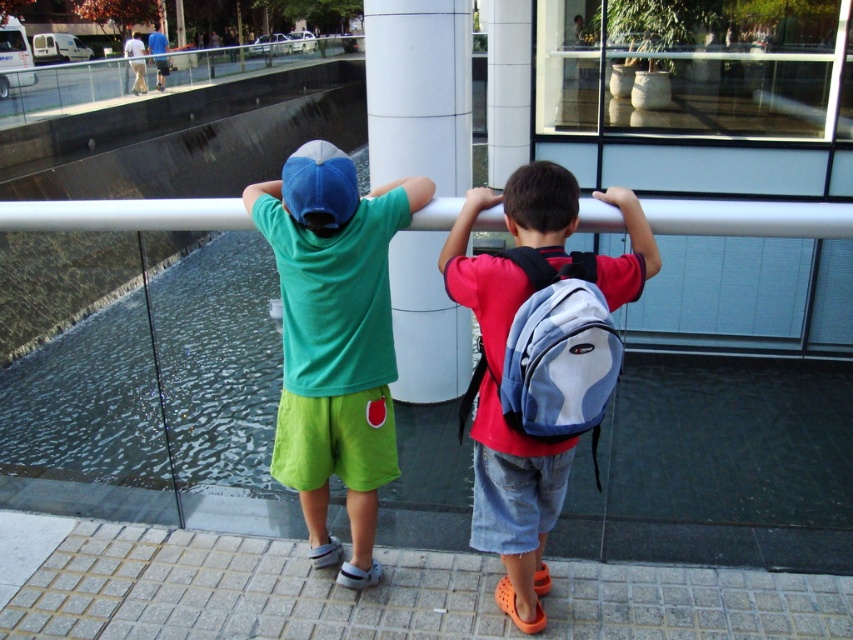
Between point (276, 476) and point (512, 218), which one is positioned behind?

Point (276, 476)

Which is above, green matte t-shirt at center or blue denim shorts at center?

green matte t-shirt at center is higher up.

Which is behind, point (311, 154) or point (525, 173)?

The point (311, 154) is behind.

The width and height of the screenshot is (853, 640). I want to click on green matte t-shirt at center, so click(334, 339).

Is blue denim shorts at center above white smooth pillar at center?

No.

Is blue denim shorts at center wider than white smooth pillar at center?

Yes.

Is point (463, 289) positioned in front of point (386, 58)?

Yes, it is.

Image resolution: width=853 pixels, height=640 pixels. I want to click on blue denim shorts at center, so click(500, 381).

The height and width of the screenshot is (640, 853). I want to click on blue denim shorts at center, so click(x=500, y=381).

Which is behind, point (463, 225) or point (592, 346)?

Positioned behind is point (463, 225).

Between point (506, 563) and point (599, 307), which one is positioned behind?

The point (506, 563) is behind.

Find the location of `blue denim shorts at center`. blue denim shorts at center is located at coordinates (500, 381).